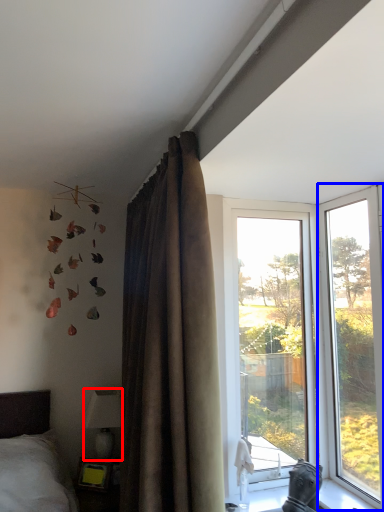
Question: Which object is closer to the camera taking this photo, lamp (highlighted by a red box) or window (highlighted by a blue box)?

Choices:
 (A) lamp
 (B) window

Answer: (B)